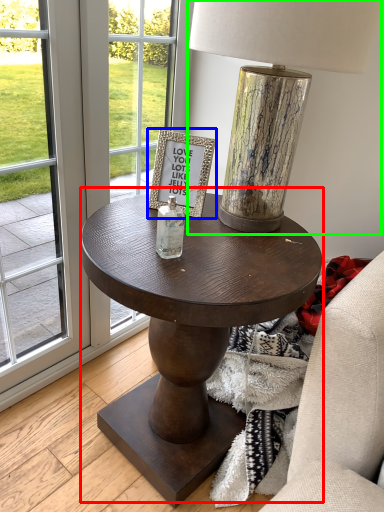
Question: Based on their relative distances, which object is nearer to coffee table (highlighted by a red box)? Choose from picture frame (highlighted by a blue box) and table lamp (highlighted by a green box).

Choices:
 (A) picture frame
 (B) table lamp

Answer: (A)